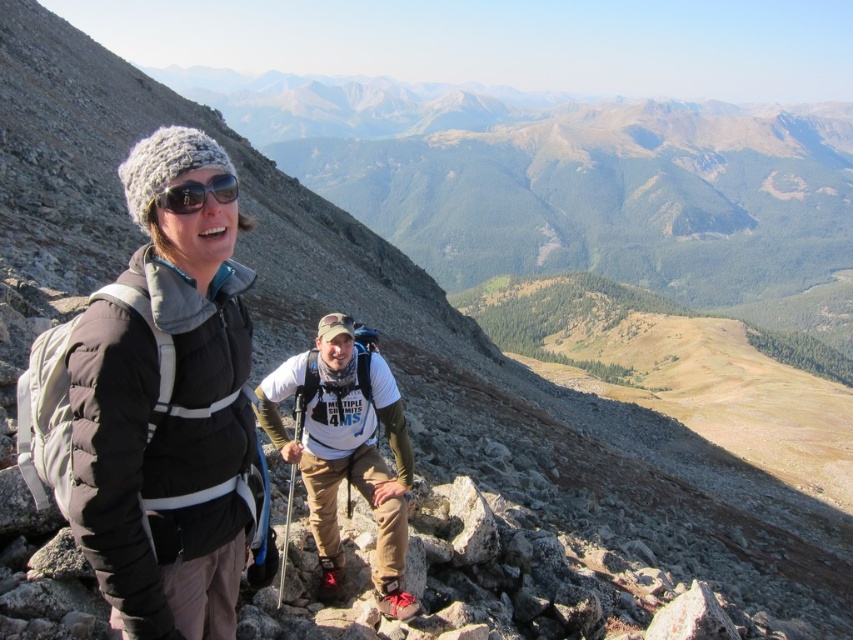
Question: In this image, where is matte white t-shirt at center located relative to matte black sunglasses at upper left?

Choices:
 (A) left
 (B) right

Answer: (B)

Question: Which of the following is the closest to the observer?

Choices:
 (A) matte white t-shirt at center
 (B) matte black sunglasses at upper left

Answer: (B)

Question: Can you confirm if matte black jacket at left is bigger than matte white t-shirt at center?

Choices:
 (A) yes
 (B) no

Answer: (A)

Question: Which object is positioned farthest from the matte white t-shirt at center?

Choices:
 (A) matte black sunglasses at upper left
 (B) matte black jacket at left

Answer: (A)

Question: Can you confirm if matte black jacket at left is positioned above matte white t-shirt at center?

Choices:
 (A) yes
 (B) no

Answer: (A)

Question: Which of the following is the closest to the observer?

Choices:
 (A) (198, 189)
 (B) (209, 440)
 (C) (291, 454)

Answer: (A)